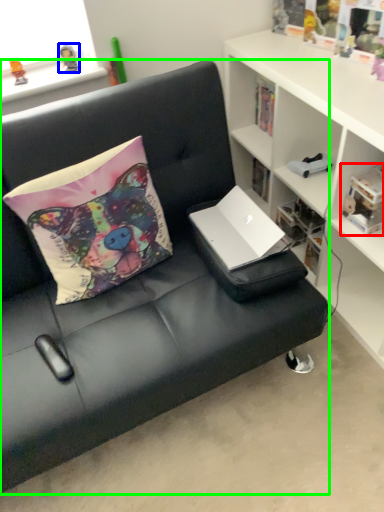
Question: Considering the real-world distances, which object is closest to book (highlighted by a red box)? toy (highlighted by a blue box) or studio couch (highlighted by a green box).

Choices:
 (A) toy
 (B) studio couch

Answer: (B)